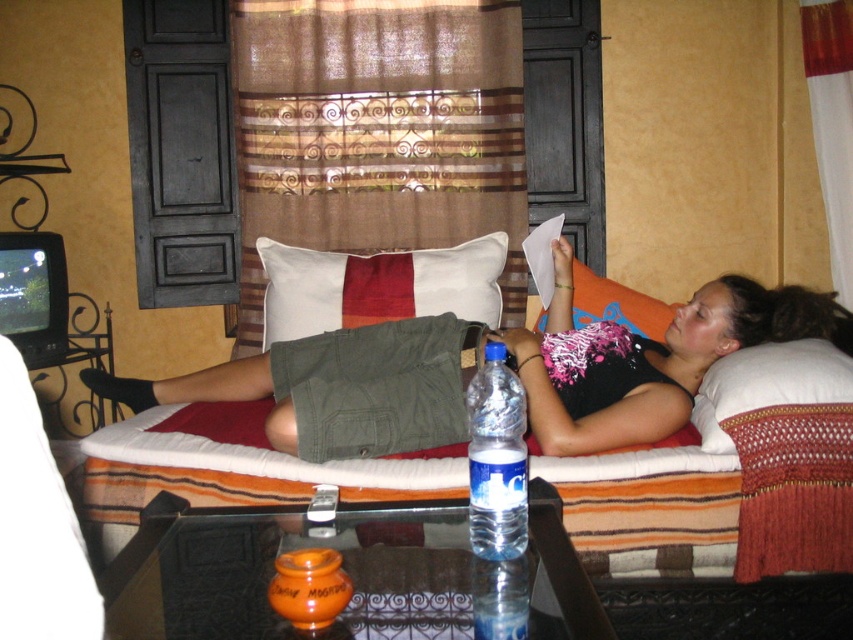
Question: Is matte black shirt at center behind white cotton pillow at center?

Choices:
 (A) no
 (B) yes

Answer: (A)

Question: Based on their relative distances, which object is nearer to the clear plastic bottle at center?

Choices:
 (A) crocheted white pillow at right
 (B) orange fabric pillow at upper right
 (C) white cotton pillow at center
 (D) matte black shirt at center

Answer: (D)

Question: Which object is positioned farthest from the orange fabric pillow at upper right?

Choices:
 (A) white cotton pillow at center
 (B) crocheted white pillow at right
 (C) matte black shirt at center

Answer: (B)

Question: Which object is the closest to the matte black shirt at center?

Choices:
 (A) crocheted white pillow at right
 (B) orange fabric pillow at upper right
 (C) clear plastic bottle at center

Answer: (A)

Question: Is matte black shirt at center below crocheted white pillow at right?

Choices:
 (A) yes
 (B) no

Answer: (B)

Question: Can you confirm if clear plastic bottle at center is positioned to the left of crocheted white pillow at right?

Choices:
 (A) no
 (B) yes

Answer: (B)